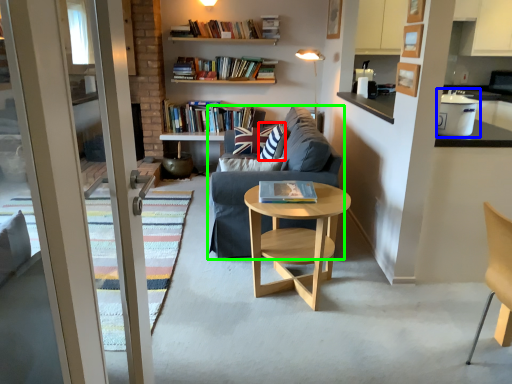
Question: Considering the real-world distances, which object is closest to pillow (highlighted by a red box)? appliance (highlighted by a blue box) or studio couch (highlighted by a green box).

Choices:
 (A) appliance
 (B) studio couch

Answer: (B)